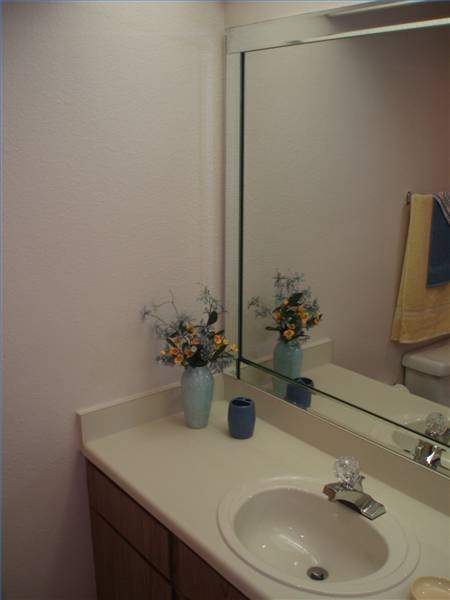
What are the coordinates of `knob` in the screenshot? It's located at (351, 468).